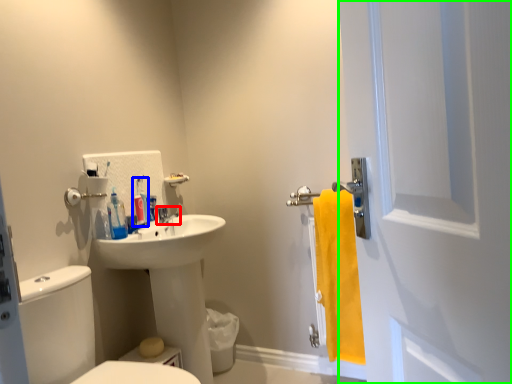
Question: Estimate the real-world distances between objects in this image. Which object is closer to tap (highlighted by a red box), toiletry (highlighted by a blue box) or screen door (highlighted by a green box)?

Choices:
 (A) toiletry
 (B) screen door

Answer: (A)